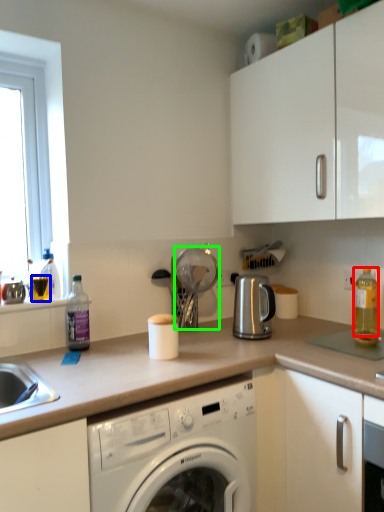
Question: Estimate the real-world distances between objects in this image. Which object is farther from bottle (highlighted by a red box), beverage (highlighted by a blue box) or appliance (highlighted by a green box)?

Choices:
 (A) beverage
 (B) appliance

Answer: (A)